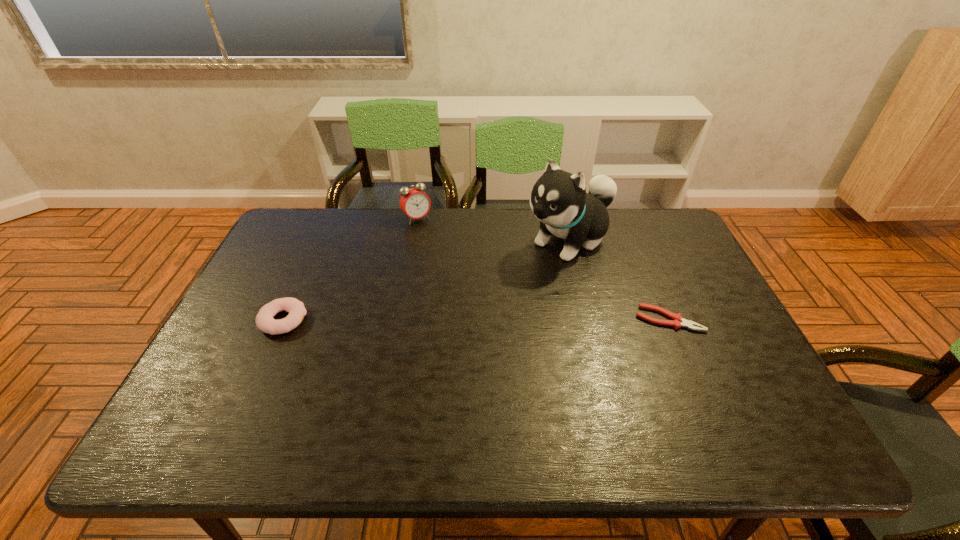
Find the location of `vacant region at the left edge`. vacant region at the left edge is located at coordinates (259, 345).

The image size is (960, 540). I want to click on vacant space at the right edge of the desktop, so click(x=669, y=252).

Where is `vacant area at the near left corner of the desktop`? The width and height of the screenshot is (960, 540). vacant area at the near left corner of the desktop is located at coordinates (232, 404).

In the image, there is a desktop. Identify the location of vacant area at the far right corner. (666, 210).

The width and height of the screenshot is (960, 540). What are the coordinates of `vacant space at the near right corner of the desktop` in the screenshot? It's located at tap(723, 403).

Locate an element on the screen. free space between the tallest object and the second object from left to right is located at coordinates (493, 230).

You are a GUI agent. You are given a task and a screenshot of the screen. Output one action in this format:
    pyautogui.click(x=<x>, y=<y>)
    Task: Click on the free space between the alarm clock and the leftmost object
    The height and width of the screenshot is (540, 960).
    Given the screenshot: What is the action you would take?
    pyautogui.click(x=350, y=269)

You are a GUI agent. You are given a task and a screenshot of the screen. Output one action in this format:
    pyautogui.click(x=<x>, y=<y>)
    Task: Click on the free spot between the pliers and the second shortest object
    This screenshot has width=960, height=540.
    Given the screenshot: What is the action you would take?
    pyautogui.click(x=476, y=320)

Locate an element on the screen. Image resolution: width=960 pixels, height=540 pixels. unoccupied position between the tallest object and the pliers is located at coordinates (619, 279).

The width and height of the screenshot is (960, 540). I want to click on empty location between the pliers and the alarm clock, so click(x=542, y=269).